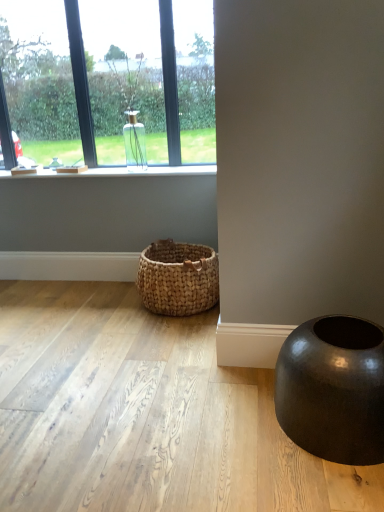
Locate an element on the screen. The image size is (384, 512). shiny black vase at lower right is located at coordinates (333, 389).

Describe the element at coordinates (110, 80) in the screenshot. This screenshot has width=384, height=512. I see `clear glass vase at upper left, which is the 2th window in right-to-left order` at that location.

Find the location of a particular element. shiny black vase at lower right is located at coordinates (333, 389).

Is shiny black vase at lower right looking in the opposite direction of clear glass vase at upper left?

No.

Which object is further away from the camera taking this photo, shiny black vase at lower right or clear glass vase at upper left?

clear glass vase at upper left is further away from the camera.

Is shiny black vase at lower right beside clear glass vase at upper left?

No, shiny black vase at lower right is not making contact with clear glass vase at upper left.

Considering the positions of objects shiny black vase at lower right and clear glass vase at upper left in the image provided, who is more to the right, shiny black vase at lower right or clear glass vase at upper left?

shiny black vase at lower right is more to the right.

In the image, is shiny black vase at lower right on the left side or the right side of clear glass vase at upper left, which is the 2th window in right-to-left order?

shiny black vase at lower right is to the right of clear glass vase at upper left, which is the 2th window in right-to-left order.

Between point (347, 360) and point (34, 13), which one is positioned behind?

The point (34, 13) is more distant.

Considering the sizes of objects shiny black vase at lower right and clear glass vase at upper left, which is the 2th window in right-to-left order, in the image provided, who is bigger, shiny black vase at lower right or clear glass vase at upper left, which is the 2th window in right-to-left order,?

clear glass vase at upper left, which is the 2th window in right-to-left order, is bigger.

From a real-world perspective, between shiny black vase at lower right and clear glass vase at upper left, which is the 1th window from left to right, who is vertically higher?

clear glass vase at upper left, which is the 1th window from left to right.

At what (x,y) coordinates should I click in order to perform the action: click on window sill on the left of shiny black vase at lower right. Please return your answer as a coordinate pair (x, y). The height and width of the screenshot is (512, 384). Looking at the image, I should click on (132, 172).

Does point (90, 170) come closer to viewer compared to point (309, 342)?

No, (90, 170) is behind (309, 342).

Is shiny black vase at lower right inside clear glass vase at upper left?

No, shiny black vase at lower right is located outside of clear glass vase at upper left.

Which of these two, clear glass vase at upper left or shiny black vase at lower right, is smaller?

clear glass vase at upper left.

From a real-world perspective, is clear glass vase at upper left physically located above or below woven natural basket at lower center?

From a real-world perspective, clear glass vase at upper left is physically above woven natural basket at lower center.

Are clear glass vase at upper left and woven natural basket at lower center far apart?

No, clear glass vase at upper left is in close proximity to woven natural basket at lower center.

Which object is further away from the camera, clear glass vase at upper left or woven natural basket at lower center?

clear glass vase at upper left is further away from the camera.

Is clear glass vase at upper left surrounding woven natural basket at lower center?

No, woven natural basket at lower center is not a part of clear glass vase at upper left.

From the picture: Considering the relative sizes of clear glass vase at upper left and clear glass vase at upper left, which is the 2th window in right-to-left order, in the image provided, is clear glass vase at upper left wider than clear glass vase at upper left, which is the 2th window in right-to-left order,?

Yes, clear glass vase at upper left is wider than clear glass vase at upper left, which is the 2th window in right-to-left order.

Is there a large distance between clear glass vase at upper left and clear glass vase at upper left, which is the 2th window in right-to-left order?

No, clear glass vase at upper left is not far from clear glass vase at upper left, which is the 2th window in right-to-left order.

From a real-world perspective, is clear glass vase at upper left positioned above or below clear glass vase at upper left, which is the 2th window in right-to-left order?

In terms of real-world spatial position, clear glass vase at upper left is below clear glass vase at upper left, which is the 2th window in right-to-left order.

Is clear glass vase at upper left, which is the 2th window in right-to-left order, bigger or smaller than shiny black vase at lower right?

Clearly, clear glass vase at upper left, which is the 2th window in right-to-left order, is larger in size than shiny black vase at lower right.

Is clear glass vase at upper left, which is the 1th window from left to right, next to shiny black vase at lower right and touching it?

They are not placed beside each other.

Is clear glass vase at upper left, which is the 2th window in right-to-left order, facing away from shiny black vase at lower right?

No, shiny black vase at lower right is not at the back of clear glass vase at upper left, which is the 2th window in right-to-left order.

Is clear glass vase at upper left, which is the 1th window from left to right, wider or thinner than shiny black vase at lower right?

clear glass vase at upper left, which is the 1th window from left to right, is thinner than shiny black vase at lower right.

From a real-world perspective, between woven natural basket at lower center and clear glass vase at upper left, the 2th window when ordered from left to right, who is vertically lower?

woven natural basket at lower center.

Looking at the image, does woven natural basket at lower center seem bigger or smaller compared to clear glass vase at upper left, which is the first window from right to left?

woven natural basket at lower center is smaller than clear glass vase at upper left, which is the first window from right to left.

Which is in front, point (197, 308) or point (131, 50)?

The point (197, 308) is closer.

Does woven natural basket at lower center lie in front of clear glass vase at upper left, which is the first window from right to left?

That is True.

I want to click on window sill that appears behind the shiny black vase at lower right, so click(132, 172).

This screenshot has height=512, width=384. I want to click on oval that appears in front of the clear glass vase at upper left, which is the 2th window in right-to-left order, so click(x=333, y=389).

When comparing their distances from shiny black vase at lower right, does clear glass vase at upper left or woven natural basket at lower center seem further?

The object further to shiny black vase at lower right is clear glass vase at upper left.

Which object lies further to the anchor point woven natural basket at lower center, clear glass vase at upper left or clear glass vase at upper left, which is the 2th window in right-to-left order?

The object further to woven natural basket at lower center is clear glass vase at upper left, which is the 2th window in right-to-left order.

Considering their positions, is clear glass vase at upper left positioned further to clear glass vase at upper left, the 2th window when ordered from left to right, than woven natural basket at lower center?

woven natural basket at lower center is further to clear glass vase at upper left, the 2th window when ordered from left to right.

Based on their spatial positions, is clear glass vase at upper left, which is the first window from right to left, or clear glass vase at upper left, which is the 2th window in right-to-left order, further from woven natural basket at lower center?

Based on the image, clear glass vase at upper left, which is the 2th window in right-to-left order, appears to be further to woven natural basket at lower center.

Estimate the real-world distances between objects in this image. Which object is closer to clear glass vase at upper left, shiny black vase at lower right or clear glass vase at upper left, which is the 2th window in right-to-left order?

clear glass vase at upper left, which is the 2th window in right-to-left order.

Based on their spatial positions, is clear glass vase at upper left, which is the first window from right to left, or shiny black vase at lower right closer to clear glass vase at upper left, which is the 2th window in right-to-left order?

Based on the image, clear glass vase at upper left, which is the first window from right to left, appears to be nearer to clear glass vase at upper left, which is the 2th window in right-to-left order.

From the picture: Which object lies nearer to the anchor point clear glass vase at upper left, which is the 1th window from left to right, clear glass vase at upper left or clear glass vase at upper left, which is the first window from right to left?

clear glass vase at upper left, which is the first window from right to left.

In the scene shown: When comparing their distances from clear glass vase at upper left, which is the 1th window from left to right, does woven natural basket at lower center or clear glass vase at upper left, which is the first window from right to left, seem closer?

Based on the image, clear glass vase at upper left, which is the first window from right to left, appears to be nearer to clear glass vase at upper left, which is the 1th window from left to right.

Where is `window sill between clear glass vase at upper left, which is the 1th window from left to right, and woven natural basket at lower center in the up-down direction`? window sill between clear glass vase at upper left, which is the 1th window from left to right, and woven natural basket at lower center in the up-down direction is located at coordinates point(132,172).

What are the coordinates of `basket between clear glass vase at upper left, which is the 1th window from left to right, and shiny black vase at lower right in the up-down direction` in the screenshot? It's located at [178, 278].

Locate an element on the screen. window that lies between clear glass vase at upper left, which is the 2th window in right-to-left order, and clear glass vase at upper left from top to bottom is located at coordinates (124, 73).

What are the coordinates of `window sill between clear glass vase at upper left, which is the first window from right to left, and woven natural basket at lower center vertically` in the screenshot? It's located at (132, 172).